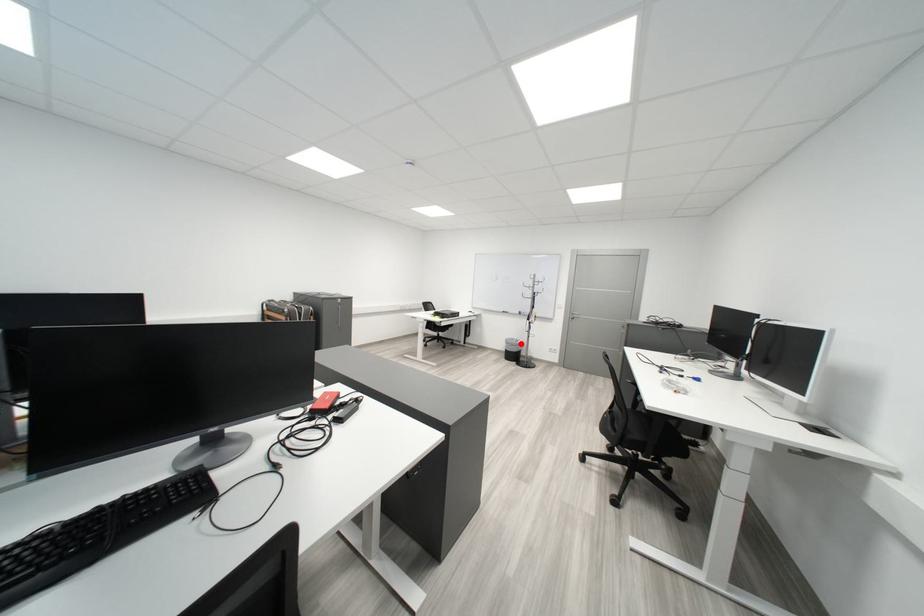
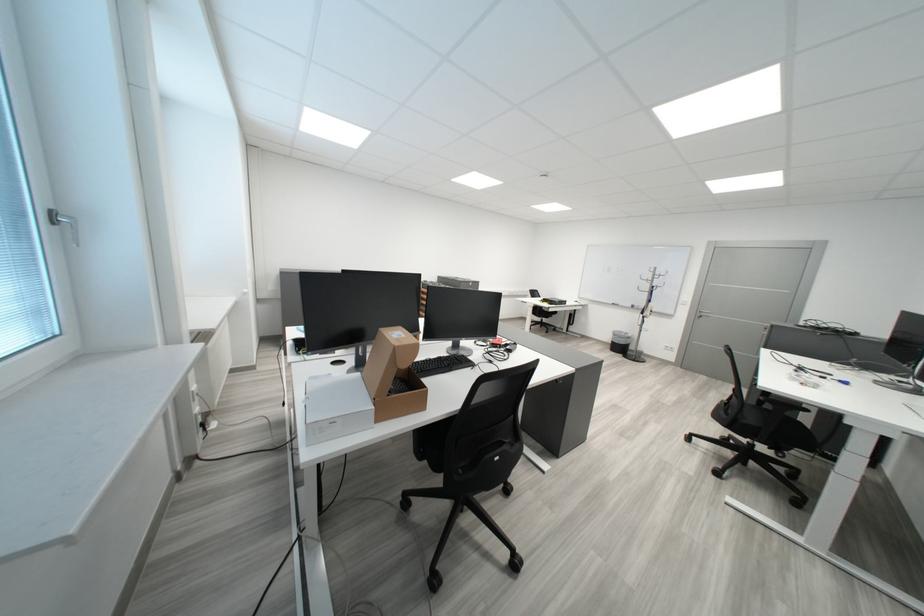
The point at the highlighted location is marked in the first image. Where is the corresponding point in the second image?

(627, 336)